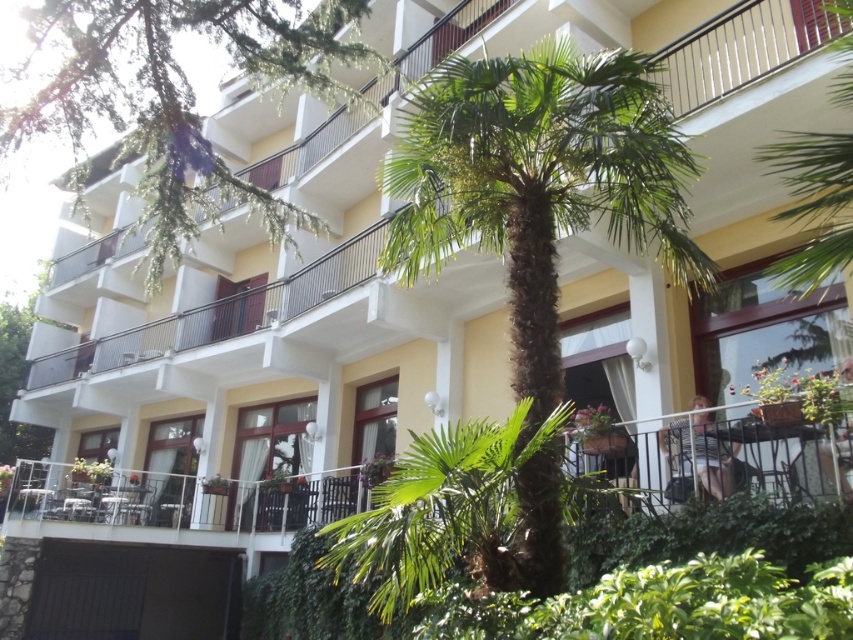
You are standing at the entrance of the building and want to plant a new shrub near the green leafy palm tree at center. Based on the coordinates provided, in which direction should you walk from the building to reach the palm tree?

The green leafy palm tree at center is located at coordinates point (538, 180). Since the coordinates are relative to the image, you should walk towards the center area of the scene to reach the palm tree.

You are standing in front of the building and want to take a photo. There are two points marked in the image, point (434, 129) and point (91, 1). Which point will appear closer to the camera in your photo?

Point (434, 129) is closer to the camera than point (91, 1), so it will appear closer in the photo.

You are standing in front of the building and notice two green leafy trees. One is the green leafy palm tree at center and the other is the green leafy tree at upper left. Which tree has a thicker trunk?

The green leafy tree at upper left has a thicker trunk than the green leafy palm tree at center.